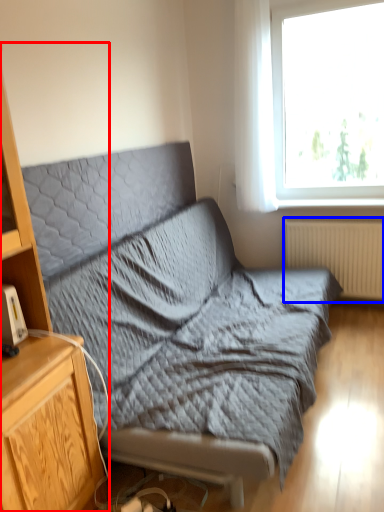
Question: Which point is further to the camera, cabinetry (highlighted by a red box) or radiator (highlighted by a blue box)?

Choices:
 (A) cabinetry
 (B) radiator

Answer: (B)